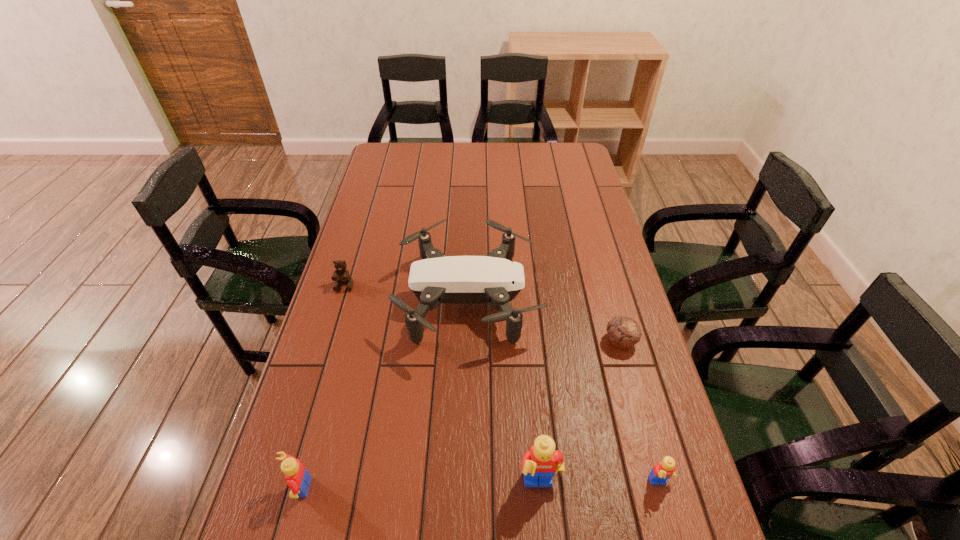
Locate an element on the screen. vacant space located 0.090m on the camera side of the drone is located at coordinates (568, 299).

Image resolution: width=960 pixels, height=540 pixels. I want to click on vacant region located on the back of the muffin, so click(607, 293).

At what (x,y) coordinates should I click in order to perform the action: click on free location located on the face of the teddy bear. Please return your answer as a coordinate pair (x, y). Looking at the image, I should click on (315, 384).

The height and width of the screenshot is (540, 960). Find the location of `Lego at the left edge`. Lego at the left edge is located at coordinates (298, 479).

Where is `teddy bear at the left edge`? The width and height of the screenshot is (960, 540). teddy bear at the left edge is located at coordinates (341, 275).

Find the location of a particular element. The height and width of the screenshot is (540, 960). Lego at the right edge is located at coordinates (662, 471).

Locate an element on the screen. The width and height of the screenshot is (960, 540). muffin that is at the right edge is located at coordinates (623, 331).

Where is `object that is at the near left corner`? The height and width of the screenshot is (540, 960). object that is at the near left corner is located at coordinates (298, 479).

In the image, there is a desktop. Identify the location of vacant space at the near edge. This screenshot has width=960, height=540. (384, 516).

Identify the location of vacant region at the left edge of the desktop. (319, 463).